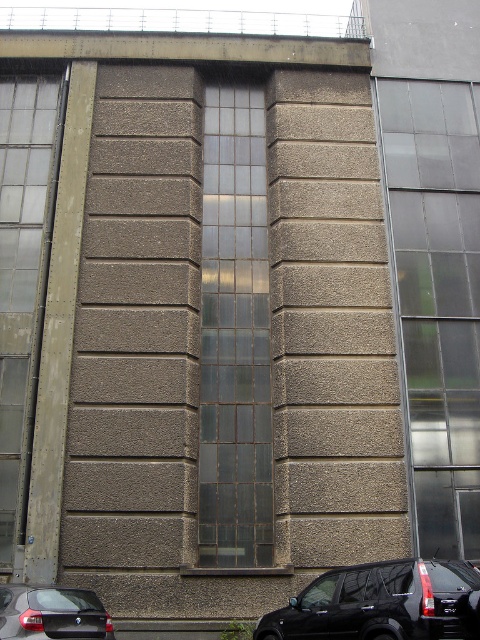
How far apart are transparent glass window at center and clear glass window at left?

The distance of transparent glass window at center from clear glass window at left is 3.19 meters.

Is transparent glass window at center wider than clear glass window at left?

No.

Is point (249, 550) closer to viewer compared to point (6, 193)?

Yes, point (249, 550) is in front of point (6, 193).

This screenshot has width=480, height=640. Identify the location of transparent glass window at center. (235, 336).

Is point (11, 413) closer to camera compared to point (22, 628)?

That is False.

Describe the element at coordinates (23, 278) in the screenshot. This screenshot has height=640, width=480. I see `clear glass window at left` at that location.

Locate an element on the screen. The height and width of the screenshot is (640, 480). clear glass window at left is located at coordinates click(23, 278).

Who is positioned more to the right, transparent glass window at right or clear glass window at left?

transparent glass window at right

Is transparent glass window at right thinner than clear glass window at left?

No, transparent glass window at right is not thinner than clear glass window at left.

Does point (466, 268) come behind point (20, 419)?

Yes, it is behind point (20, 419).

Find the location of a particular element. transparent glass window at right is located at coordinates (437, 298).